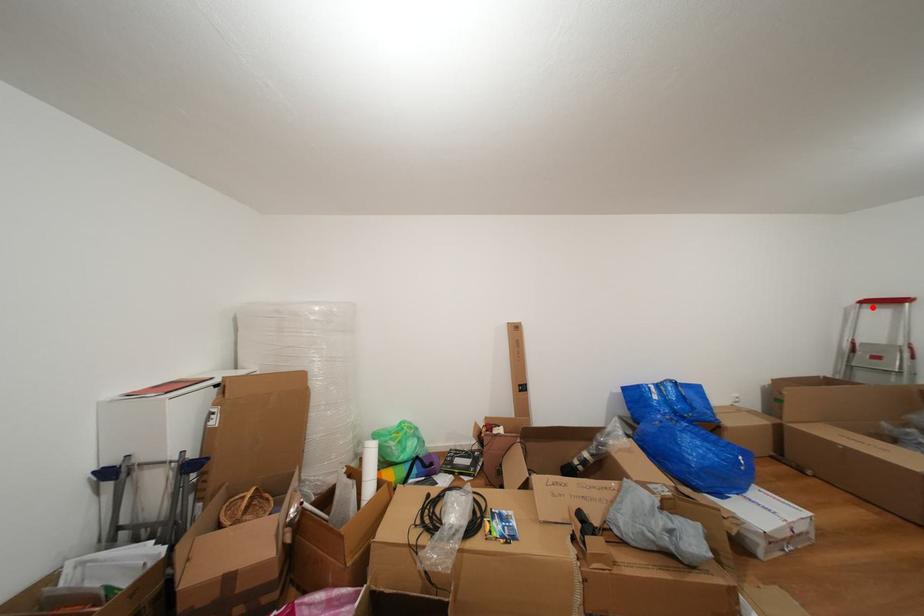
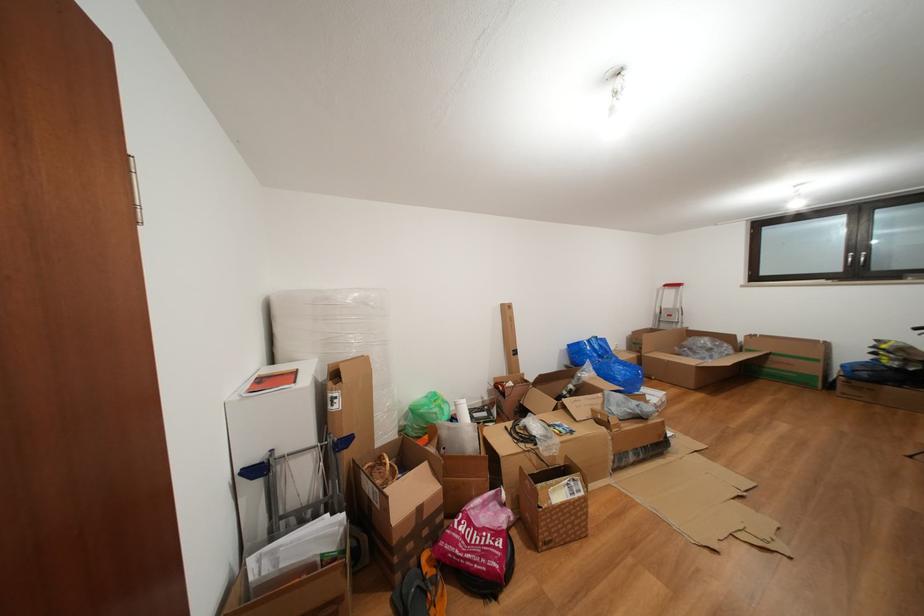
In the second image, find the point that corresponds to the highlighted location in the first image.

(674, 291)